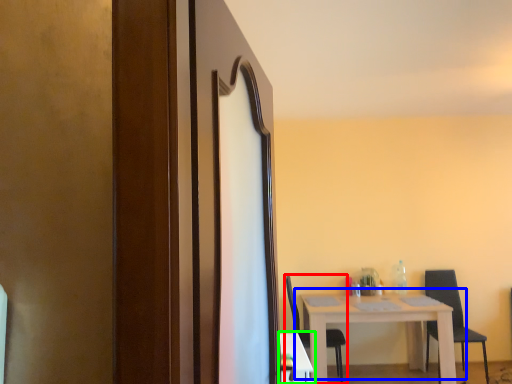
Question: Considering the real-world distances, which object is closest to chair (highlighted by a red box)? table (highlighted by a blue box) or table (highlighted by a green box).

Choices:
 (A) table
 (B) table

Answer: (A)